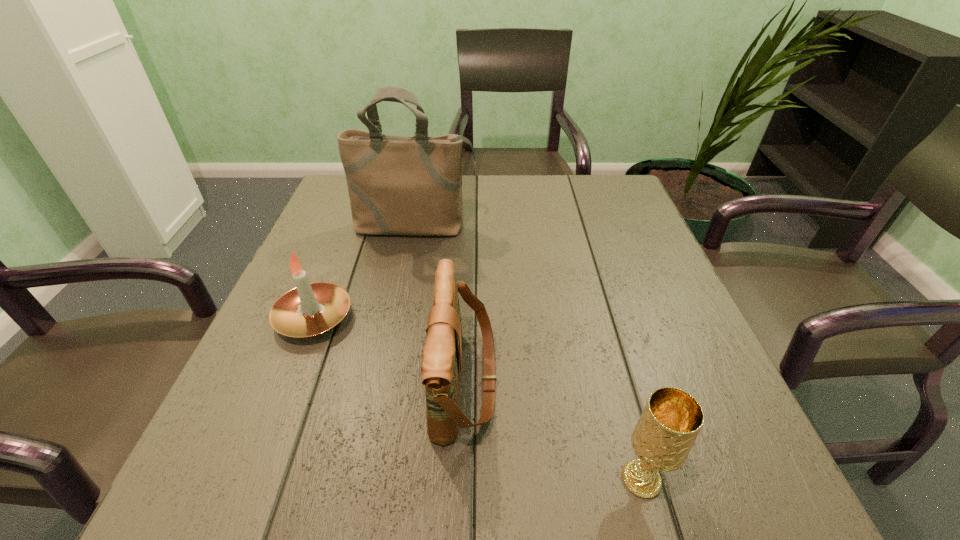
Locate an element on the screen. The height and width of the screenshot is (540, 960). vacant region at the right edge of the desktop is located at coordinates (611, 293).

Identify the location of vacant space at the far left corner of the desktop. (346, 187).

Find the location of a particular element. The width and height of the screenshot is (960, 540). vacant space at the near left corner of the desktop is located at coordinates click(293, 503).

Locate an element on the screen. The height and width of the screenshot is (540, 960). vacant space at the far right corner of the desktop is located at coordinates (618, 175).

This screenshot has width=960, height=540. Find the location of `vacant space that's between the taller shoulder bag and the rightmost object`. vacant space that's between the taller shoulder bag and the rightmost object is located at coordinates (528, 353).

Image resolution: width=960 pixels, height=540 pixels. Find the location of `free point between the nearer shoulder bag and the nearest object`. free point between the nearer shoulder bag and the nearest object is located at coordinates (553, 430).

Image resolution: width=960 pixels, height=540 pixels. In order to click on free space between the nearer shoulder bag and the rightmost object in this screenshot , I will do `click(553, 430)`.

The height and width of the screenshot is (540, 960). Find the location of `unoccupied area between the nearest object and the tallest object`. unoccupied area between the nearest object and the tallest object is located at coordinates (528, 353).

Identify the location of free space between the nearest object and the candle. This screenshot has width=960, height=540. coord(478,399).

Find the location of `free space between the nearest object and the farther shoulder bag`. free space between the nearest object and the farther shoulder bag is located at coordinates (528, 353).